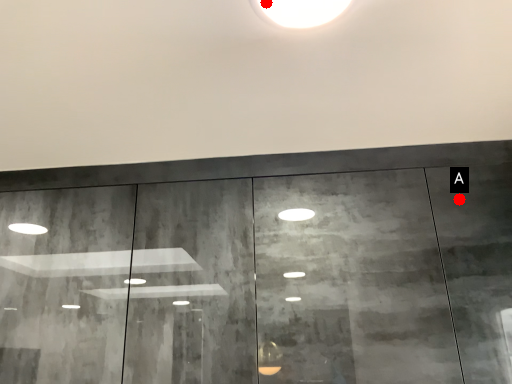
Question: Two points are circled on the image, labeled by A and B beside each circle. Which point is closer to the camera taking this photo?

Choices:
 (A) A is closer
 (B) B is closer

Answer: (B)